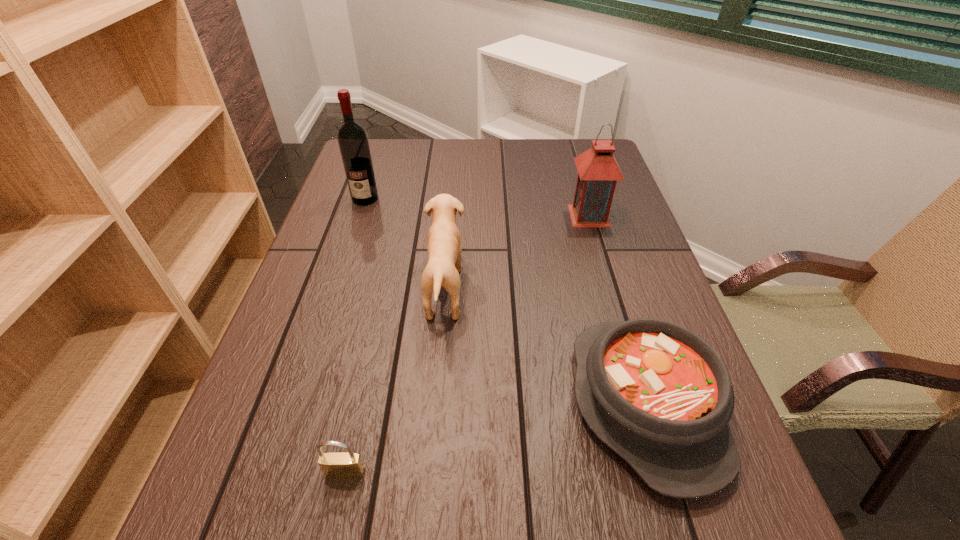
Locate which object ranks fourth in proximity to the alcohol. Please provide its 2D coordinates. Your answer should be formatted as a tuple, i.e. [(x, y)], where the tuple contains the x and y coordinates of a point satisfying the conditions above.

[(339, 465)]

The image size is (960, 540). What are the coordinates of `blank space that satisfies the following two spatial constraints: 1. on the left side of the third object from left to right; 2. on the front-facing side of the padlock` in the screenshot? It's located at (430, 473).

Locate an element on the screen. vacant position in the image that satisfies the following two spatial constraints: 1. on the front and back of the leftmost object; 2. on the left side of the casserole is located at coordinates (298, 404).

You are a GUI agent. You are given a task and a screenshot of the screen. Output one action in this format:
    pyautogui.click(x=<x>, y=<y>)
    Task: Click on the free space that satisfies the following two spatial constraints: 1. on the back side of the casserole; 2. on the left side of the third object from right to left
    
    Given the screenshot: What is the action you would take?
    pyautogui.click(x=611, y=289)

Identify the location of vacant space that satisfies the following two spatial constraints: 1. on the left side of the third shortest object; 2. on the right side of the casserole. This screenshot has width=960, height=540. (436, 404).